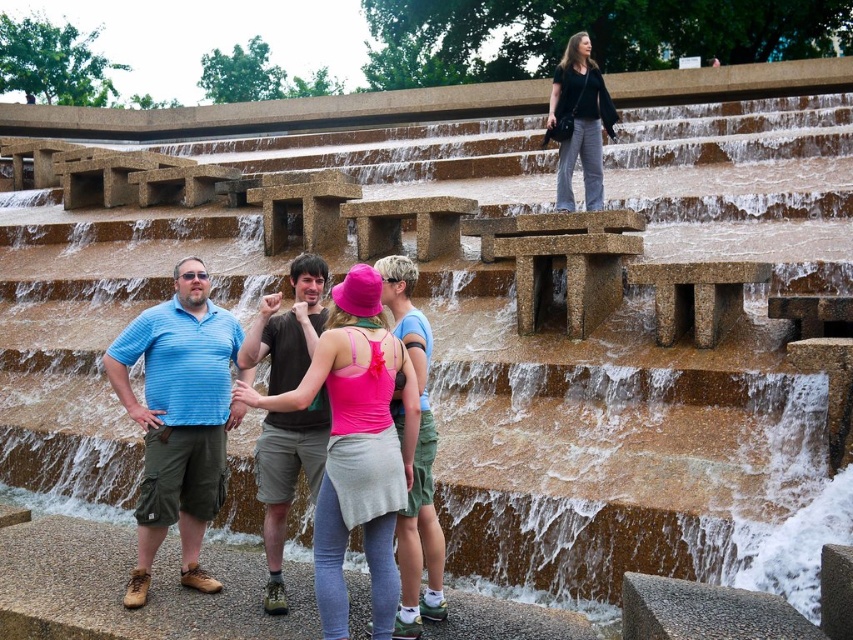
Question: Does pink fabric hat at center appear on the left side of blue striped polo shirt at center?

Choices:
 (A) no
 (B) yes

Answer: (A)

Question: From the image, what is the correct spatial relationship of blue striped polo shirt at center in relation to pink fabric tank top at center?

Choices:
 (A) left
 (B) right

Answer: (A)

Question: Among these points, which one is farthest from the camera?

Choices:
 (A) (573, 45)
 (B) (315, 348)
 (C) (158, 444)

Answer: (A)

Question: Does pink fabric hat at center appear on the left side of black cotton shirt at upper right?

Choices:
 (A) no
 (B) yes

Answer: (B)

Question: Among these objects, which one is nearest to the camera?

Choices:
 (A) black cotton shirt at upper right
 (B) pink fabric hat at center

Answer: (B)

Question: Which point is closer to the camera?

Choices:
 (A) (567, 131)
 (B) (213, 493)
 (C) (422, 528)
 (D) (335, 305)

Answer: (D)